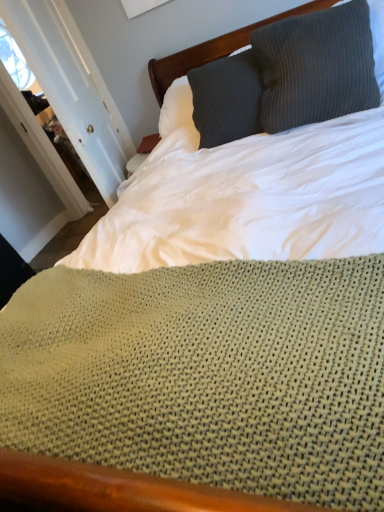
Question: Considering the relative sizes of knitted gray pillow at upper right and white painted wood door at upper left in the image provided, is knitted gray pillow at upper right shorter than white painted wood door at upper left?

Choices:
 (A) no
 (B) yes

Answer: (B)

Question: Could you tell me if knitted gray pillow at upper right is facing white painted wood door at upper left?

Choices:
 (A) yes
 (B) no

Answer: (B)

Question: Considering the relative sizes of knitted gray pillow at upper right and white painted wood door at upper left in the image provided, is knitted gray pillow at upper right smaller than white painted wood door at upper left?

Choices:
 (A) no
 (B) yes

Answer: (B)

Question: From a real-world perspective, is knitted gray pillow at upper right positioned under white painted wood door at upper left based on gravity?

Choices:
 (A) no
 (B) yes

Answer: (B)

Question: Are knitted gray pillow at upper right and white painted wood door at upper left located far from each other?

Choices:
 (A) yes
 (B) no

Answer: (A)

Question: Is the depth of knitted gray pillow at upper right less than that of white painted wood door at upper left?

Choices:
 (A) yes
 (B) no

Answer: (A)

Question: Can you confirm if white painted wood door at upper left is positioned to the right of knitted gray pillow at upper right?

Choices:
 (A) yes
 (B) no

Answer: (B)

Question: Is white painted wood door at upper left positioned behind knitted gray pillow at upper right?

Choices:
 (A) no
 (B) yes

Answer: (B)

Question: Is white painted wood door at upper left closer to the viewer compared to knitted gray pillow at upper right?

Choices:
 (A) no
 (B) yes

Answer: (A)

Question: Considering the relative sizes of white painted wood door at upper left and knitted gray pillow at upper right in the image provided, is white painted wood door at upper left taller than knitted gray pillow at upper right?

Choices:
 (A) no
 (B) yes

Answer: (B)

Question: Can you confirm if white painted wood door at upper left is wider than knitted gray pillow at upper right?

Choices:
 (A) yes
 (B) no

Answer: (B)

Question: From a real-world perspective, is white painted wood door at upper left located beneath knitted gray pillow at upper right?

Choices:
 (A) yes
 (B) no

Answer: (B)

Question: Considering their positions, is knitted gray pillow at upper right located in front of or behind white painted wood door at upper left?

Choices:
 (A) front
 (B) behind

Answer: (A)